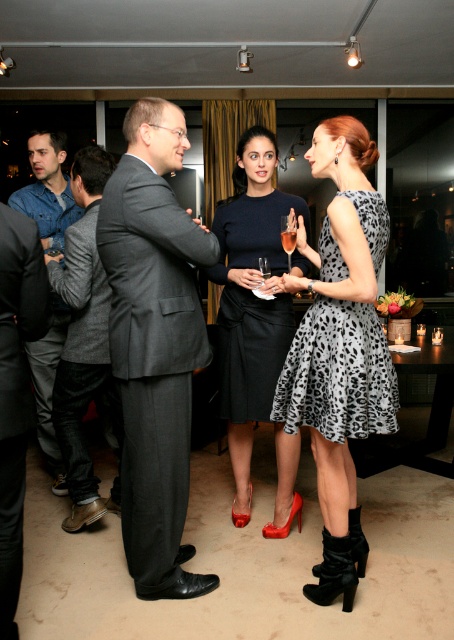
You are at point (18, 337) and want to move to point (263, 148). Considering the layout of the room, will you need to walk around any obstacles or can you go straight?

Since point (263, 148) is behind point (18, 337), you can go straight to reach it without needing to walk around any obstacles.